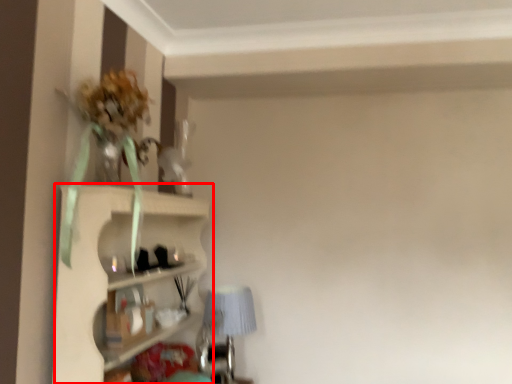
Question: Observing the image, what is the correct spatial positioning of shelf (annotated by the red box) in reference to table lamp?

Choices:
 (A) left
 (B) right

Answer: (A)